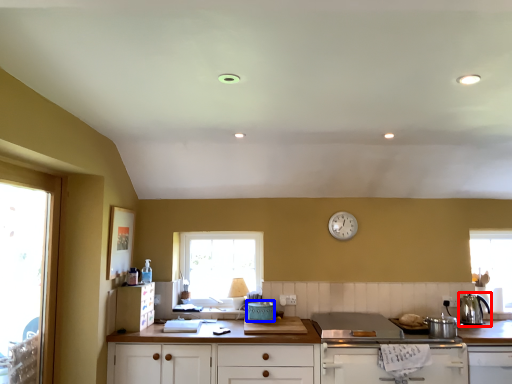
Question: Which object is closer to the camera taking this photo, kitchen appliance (highlighted by a red box) or appliance (highlighted by a blue box)?

Choices:
 (A) kitchen appliance
 (B) appliance

Answer: (A)